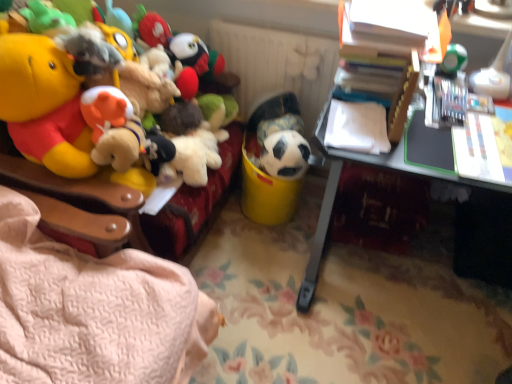
Question: From a real-world perspective, is soft plush toys at left, acting as the first toy starting from the left, physically located above or below white matte radiator at upper center?

Choices:
 (A) below
 (B) above

Answer: (B)

Question: Would you say soft plush toys at left, positioned as the 4th toy in right-to-left order, is to the left or to the right of white matte radiator at upper center in the picture?

Choices:
 (A) left
 (B) right

Answer: (A)

Question: Considering the real-world distances, which object is closest to the soccer ball at center, the 2th toy in the left-to-right sequence?

Choices:
 (A) green matte die at upper right, which is counted as the 1th toy, starting from the right
 (B) white matte radiator at upper center
 (C) soft plush toys at left, acting as the first toy starting from the left
 (D) white plastic desk at right
 (E) black matte soccer ball at center, marked as the third toy in a left-to-right arrangement

Answer: (E)

Question: Estimate the real-world distances between objects in this image. Which object is farther from the soft plush toys at left, acting as the first toy starting from the left?

Choices:
 (A) white plastic desk at right
 (B) black matte soccer ball at center, marked as the third toy in a left-to-right arrangement
 (C) soccer ball at center, the 2th toy in the left-to-right sequence
 (D) white matte radiator at upper center
 (E) green matte die at upper right, arranged as the fourth toy when viewed from the left

Answer: (E)